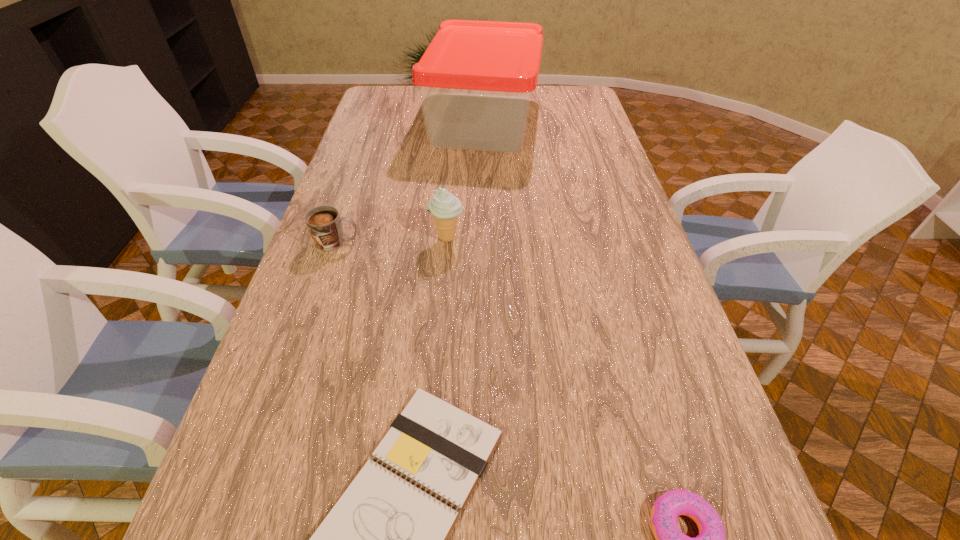
Where is `the tallest object`? This screenshot has height=540, width=960. the tallest object is located at coordinates (476, 78).

Locate an element on the screen. The width and height of the screenshot is (960, 540). the farthest object is located at coordinates [476, 78].

Locate an element on the screen. This screenshot has height=540, width=960. the fourth shortest object is located at coordinates (445, 207).

The height and width of the screenshot is (540, 960). I want to click on the leftmost object, so click(324, 223).

The width and height of the screenshot is (960, 540). In order to click on mug in this screenshot , I will do `click(324, 223)`.

Find the location of a particular element. The width and height of the screenshot is (960, 540). free region located 0.210m on the front of the tray is located at coordinates (484, 198).

Locate an element on the screen. vacant space located 0.280m on the back of the second tallest object is located at coordinates (452, 173).

At what (x,y) coordinates should I click in order to perform the action: click on vacant space situated on the side of the third tallest object with the handle. Please return your answer as a coordinate pair (x, y). Looking at the image, I should click on (505, 242).

This screenshot has width=960, height=540. Find the location of `object located in the far edge section of the desktop`. object located in the far edge section of the desktop is located at coordinates (476, 78).

At what (x,y) coordinates should I click in order to perform the action: click on object that is at the left edge. Please return your answer as a coordinate pair (x, y). Looking at the image, I should click on (324, 223).